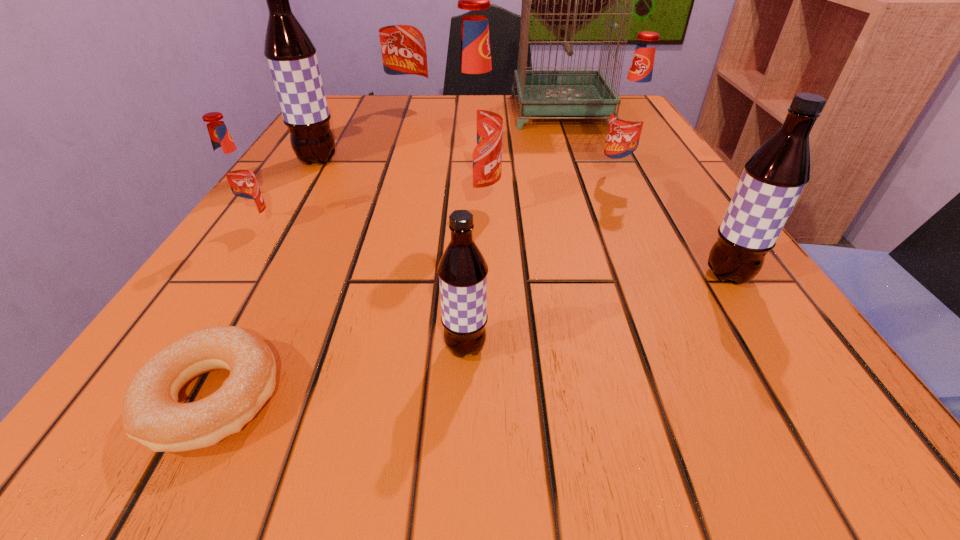
Where is `bagel that is at the left edge`? bagel that is at the left edge is located at coordinates (152, 415).

Identify the location of birdcage situated at the right edge. Image resolution: width=960 pixels, height=540 pixels. (539, 95).

Identify the location of object that is positioned at the far left corner. Image resolution: width=960 pixels, height=540 pixels. (401, 27).

Where is `object that is at the near left corner`? object that is at the near left corner is located at coordinates (152, 415).

Locate an element on the screen. This screenshot has height=540, width=960. object that is at the far right corner is located at coordinates [539, 95].

Locate an element on the screen. This screenshot has width=960, height=540. free space at the far edge is located at coordinates (x=508, y=117).

Image resolution: width=960 pixels, height=540 pixels. Identify the location of vacant space at the near edge of the desktop. (412, 394).

Locate an element on the screen. The height and width of the screenshot is (540, 960). blank space at the left edge of the desktop is located at coordinates (369, 136).

Identify the location of vacant space at the right edge of the desktop. Image resolution: width=960 pixels, height=540 pixels. (688, 227).

In the image, there is a desktop. Where is `vacant space at the far left corner`? vacant space at the far left corner is located at coordinates (368, 132).